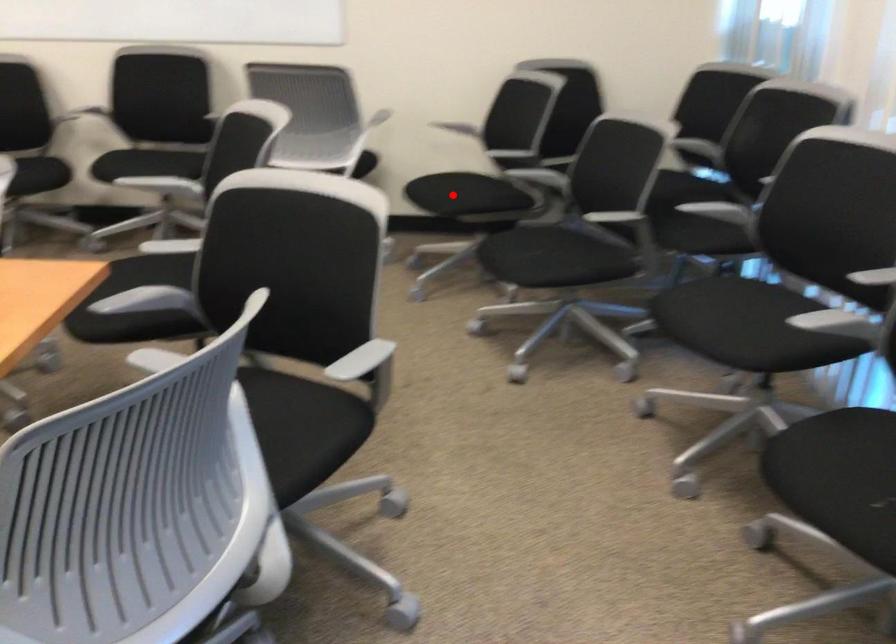
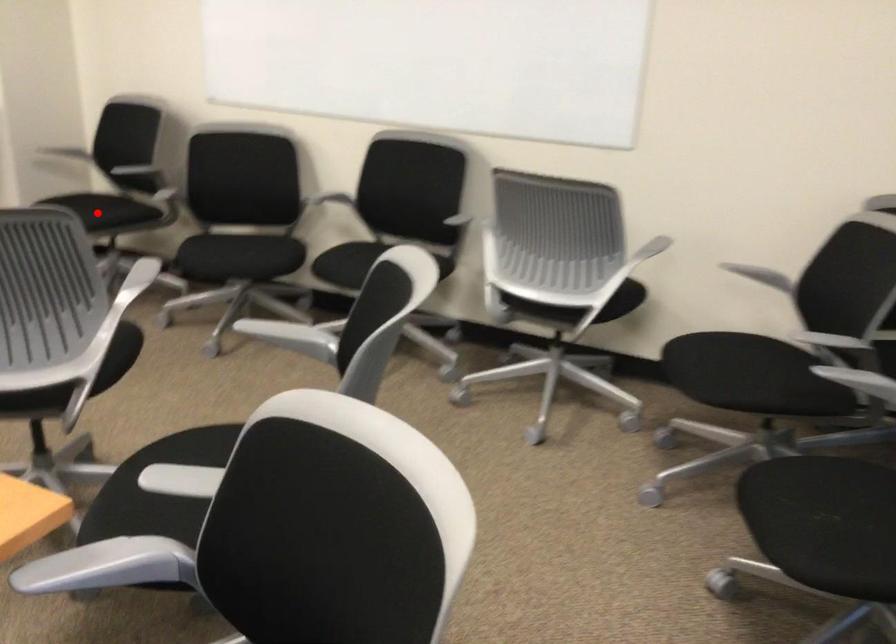
I am providing you with two images of the same scene from different viewpoints. A red point is marked on the first image and another point is marked on the second image. Do the highlighted points in image1 and image2 indicate the same real-world spot?

No